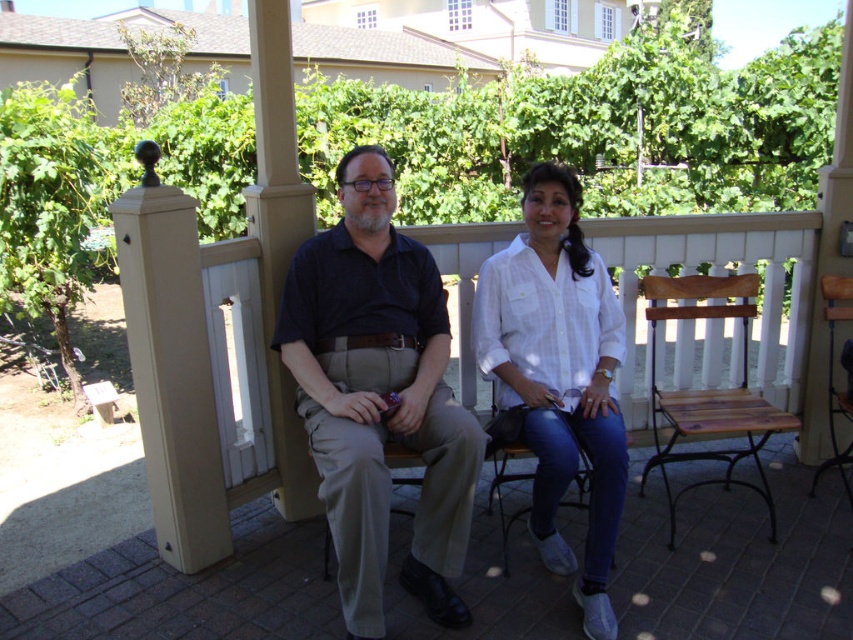
You are a photographer trying to capture a clear shot of the wooden bench at center and the white cotton shirt at center. However, you notice an obstruction. Which object is blocking the view of the other?

The white cotton shirt at center is behind the wooden bench at center, so the wooden bench is blocking the view of the white cotton shirt.

You are designing a new bench for a garden patio and want to ensure it accommodates both the dark blue shirt at center and the wooden seat at right. Based on their sizes, which object requires more space in the design?

The wooden seat at right requires more space in the design because the dark blue shirt at center has a smaller size compared to it.

You are designing a new bench for the patio and need to ensure the wooden seat at right is wide enough to accommodate the dark blue shirt at center. Based on the image, which object is narrower?

The dark blue shirt at center is narrower than the wooden seat at right, so the seat should be wide enough to accommodate it.